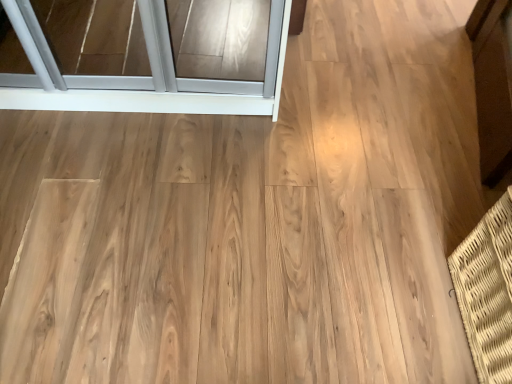
Where is `blank space situated above natural wood floor at center (from a real-world perspective)`? This screenshot has width=512, height=384. blank space situated above natural wood floor at center (from a real-world perspective) is located at coordinates (196, 200).